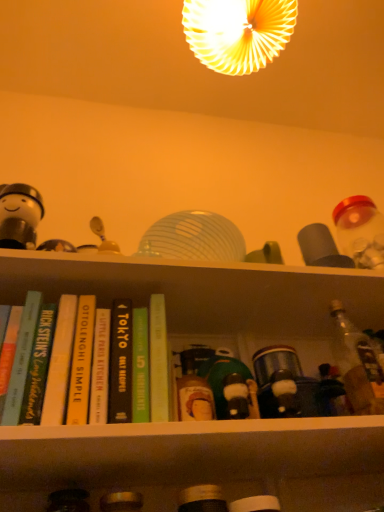
Question: Is hardcover book at left, which appears as the 5th book when viewed from the right, positioned with its back to matte yellow lampshade at upper center?

Choices:
 (A) yes
 (B) no

Answer: (B)

Question: Is the position of hardcover book at left, which appears as the 5th book when viewed from the right, less distant than that of matte yellow lampshade at upper center?

Choices:
 (A) no
 (B) yes

Answer: (B)

Question: From the image's perspective, is hardcover book at left, the first book positioned from the left, beneath matte yellow lampshade at upper center?

Choices:
 (A) no
 (B) yes

Answer: (B)

Question: Can you confirm if hardcover book at left, which appears as the 5th book when viewed from the right, is shorter than matte yellow lampshade at upper center?

Choices:
 (A) no
 (B) yes

Answer: (B)

Question: Can you confirm if hardcover book at left, the first book positioned from the left, is wider than matte yellow lampshade at upper center?

Choices:
 (A) yes
 (B) no

Answer: (B)

Question: Is hardcover book at left, the fourth book from the right, taller or shorter than clear glass bottle at right, the first bottle positioned from the top?

Choices:
 (A) short
 (B) tall

Answer: (A)

Question: In terms of size, does hardcover book at left, the fourth book from the right, appear bigger or smaller than clear glass bottle at right, which is the third bottle from bottom to top?

Choices:
 (A) small
 (B) big

Answer: (A)

Question: From a real-world perspective, is hardcover book at left, arranged as the second book when viewed from the left, positioned above or below clear glass bottle at right, placed as the 1th bottle when sorted from right to left?

Choices:
 (A) above
 (B) below

Answer: (A)

Question: Is hardcover book at left, the fourth book from the right, inside or outside of clear glass bottle at right, the first bottle positioned from the top?

Choices:
 (A) outside
 (B) inside

Answer: (A)

Question: From the image's perspective, relative to matte black bottle at lower left, the first bottle ordered from the bottom, is hardcover book at left, arranged as the second book when viewed from the left, above or below?

Choices:
 (A) above
 (B) below

Answer: (A)

Question: Considering the positions of hardcover book at left, the fourth book from the right, and matte black bottle at lower left, placed as the 1th bottle when sorted from left to right, in the image, is hardcover book at left, the fourth book from the right, taller or shorter than matte black bottle at lower left, placed as the 1th bottle when sorted from left to right,?

Choices:
 (A) tall
 (B) short

Answer: (A)

Question: Is hardcover book at left, arranged as the second book when viewed from the left, inside or outside of matte black bottle at lower left, placed as the third bottle when sorted from top to bottom?

Choices:
 (A) outside
 (B) inside

Answer: (A)

Question: Is hardcover book at left, the fourth book from the right, in front of or behind matte black bottle at lower left, placed as the third bottle when sorted from top to bottom, in the image?

Choices:
 (A) behind
 (B) front

Answer: (A)

Question: Is matte plastic bottles at center situated inside matte black bottle at lower center, the 2th bottle when ordered from bottom to top, or outside?

Choices:
 (A) inside
 (B) outside

Answer: (B)

Question: From the image's perspective, relative to matte black bottle at lower center, the 2th bottle positioned from the top, is matte plastic bottles at center above or below?

Choices:
 (A) below
 (B) above

Answer: (B)